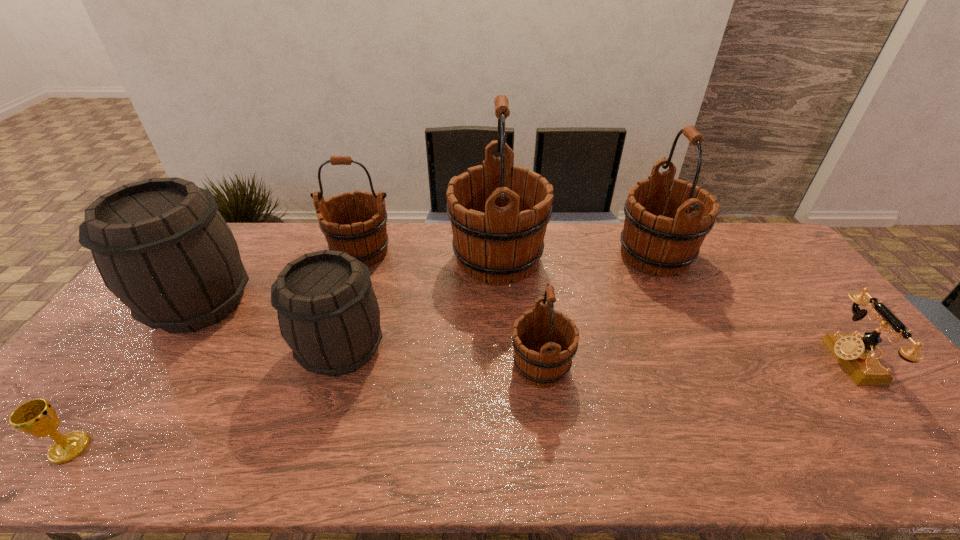
Locate which object ranks in proximity to the gold chalice. Please provide its 2D coordinates. Your answer should be formatted as a tuple, i.e. [(x, y)], where the tuple contains the x and y coordinates of a point satisfying the conditions above.

[(161, 246)]

This screenshot has height=540, width=960. Find the location of `the fourth closest wine bucket to the left brown wine bucket`. the fourth closest wine bucket to the left brown wine bucket is located at coordinates (545, 341).

Identify the location of wine bucket that is the second closest to the nearest wood wine bucket. [x=655, y=239].

You are a GUI agent. You are given a task and a screenshot of the screen. Output one action in this format:
    pyautogui.click(x=<x>, y=<y>)
    Task: Click on the third closest wood wine bucket to the chalice
    The image size is (960, 540).
    Given the screenshot: What is the action you would take?
    pyautogui.click(x=545, y=341)

Choose which wood wine bucket is the third nearest neighbor to the right brown wine bucket. Please provide its 2D coordinates. Your answer should be formatted as a tuple, i.e. [(x, y)], where the tuple contains the x and y coordinates of a point satisfying the conditions above.

[(545, 341)]

You are a GUI agent. You are given a task and a screenshot of the screen. Output one action in this format:
    pyautogui.click(x=<x>, y=<y>)
    Task: Click on the vacant area in the image that satisfies the following two spatial constraints: 1. on the back side of the tallest object; 2. on the right side of the gold chalice
    Image resolution: width=960 pixels, height=540 pixels.
    Given the screenshot: What is the action you would take?
    pyautogui.click(x=209, y=259)